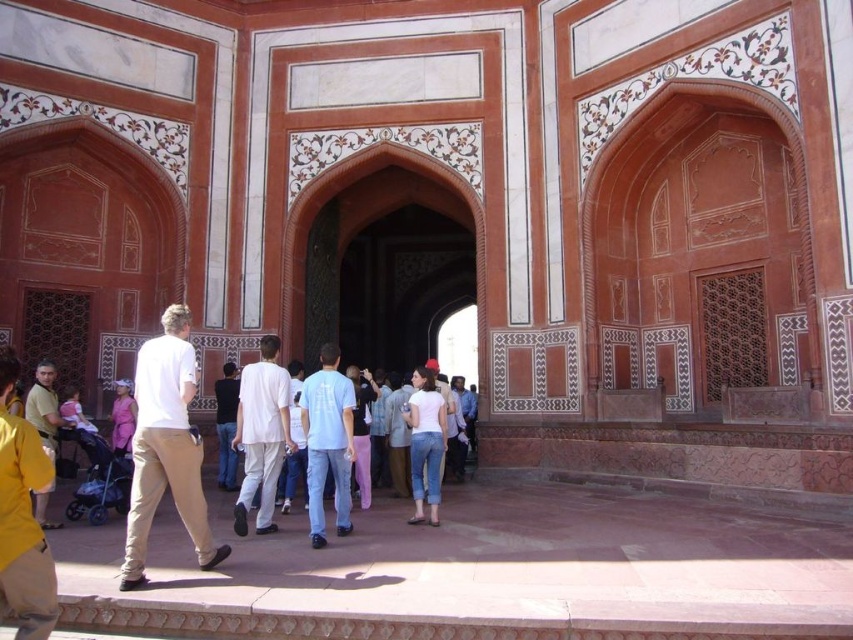
Question: Can you confirm if matte khaki shirt at lower left is smaller than light blue cotton shirt at center?

Choices:
 (A) yes
 (B) no

Answer: (A)

Question: Is the position of white cotton shirt at center more distant than that of light blue denim jeans at center?

Choices:
 (A) yes
 (B) no

Answer: (B)

Question: Which is nearer to the light blue jeans at center?

Choices:
 (A) matte khaki shirt at lower left
 (B) light blue cotton shirt at center
 (C) light blue denim jeans at center
 (D) light blue t-shirt at center

Answer: (B)

Question: Which point is farther from the camera taking this photo?

Choices:
 (A) (265, 524)
 (B) (39, 369)
 (C) (358, 385)
 (D) (225, 396)

Answer: (D)

Question: Which object is positioned closest to the white cotton shirt at left?

Choices:
 (A) matte khaki shirt at lower left
 (B) light blue denim jeans at center
 (C) light blue jeans at center
 (D) light blue cotton shirt at center

Answer: (A)

Question: Can you confirm if white cotton shirt at left is positioned to the right of white cotton shirt at center?

Choices:
 (A) no
 (B) yes

Answer: (A)